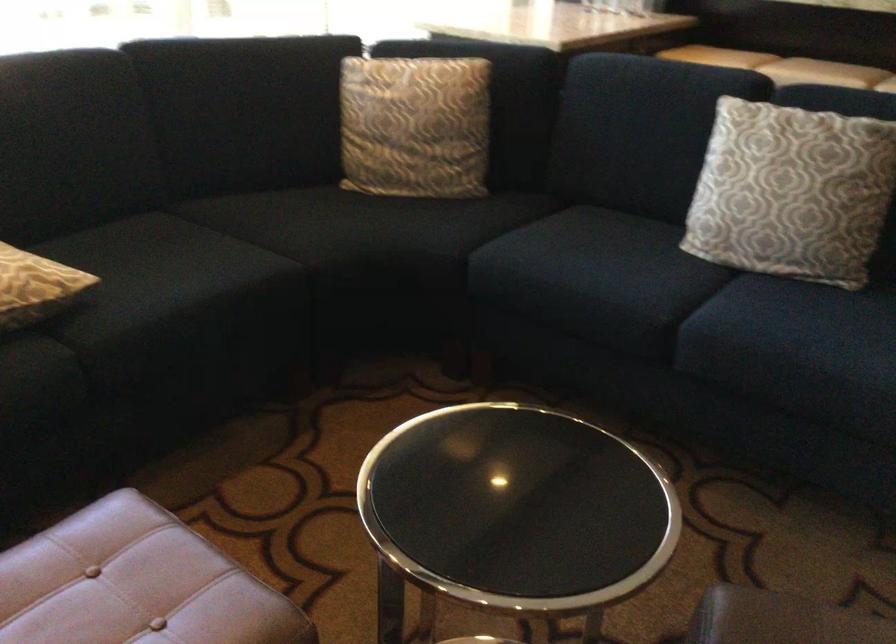
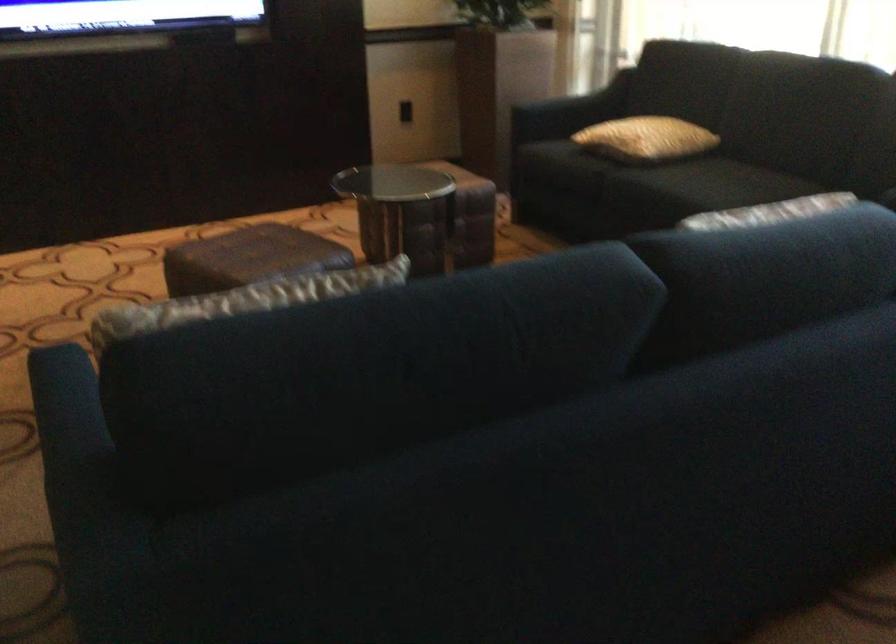
Question: I am providing you with two images of the same scene from different viewpoints. Please identify which objects are invisible in image2.

Choices:
 (A) red-capped board marker
 (B) yellow pillow
 (C) dark sofa armrest
 (D) sofa sitting surface

Answer: (D)